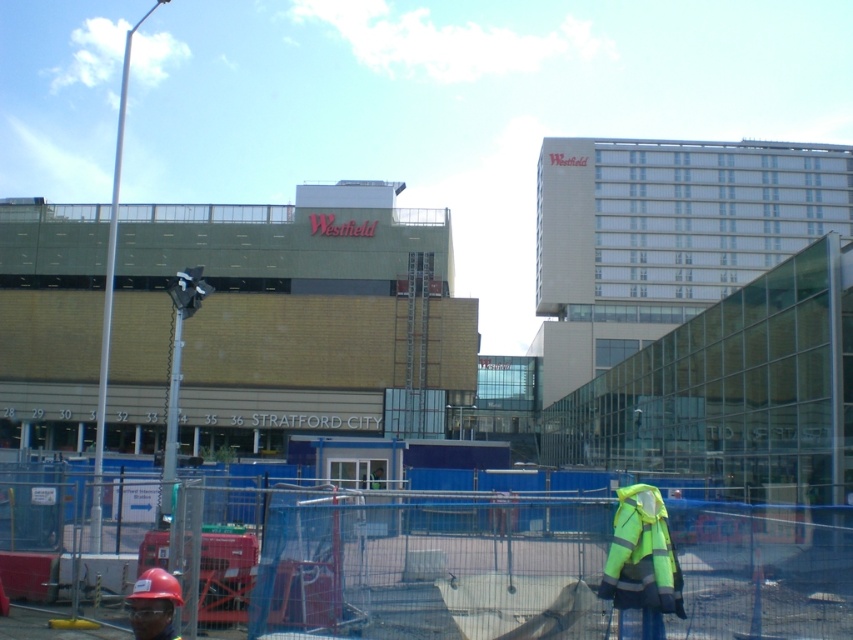
You are a construction worker standing at the point marked as point (378, 561). You need to move to the nearest construction barrier. Which direction should you go?

The point (378, 561) is on the blue mesh fence at lower center, so the nearest construction barrier is the bright yellow construction barrier. You should move towards the bright yellow construction barrier direction.

You are a safety inspector at the construction site and need to ensure that the blue mesh fence at lower center and the neon yellow reflective vest at lower right are within the required safety distance of 15 feet. Can you confirm if they meet the safety standards?

The blue mesh fence at lower center is 17.80 feet from the neon yellow reflective vest at lower right, which exceeds the required 15 feet safety distance. Therefore, they do not meet the safety standards.